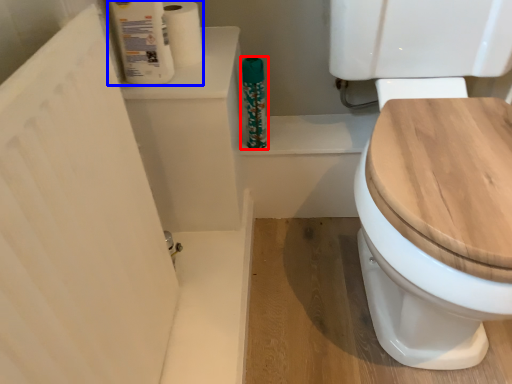
Question: Which object is closer to the camera taking this photo, cleaning product (highlighted by a red box) or toilet paper (highlighted by a blue box)?

Choices:
 (A) cleaning product
 (B) toilet paper

Answer: (B)